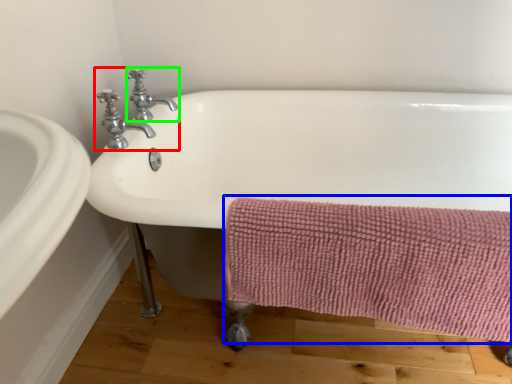
Question: Estimate the real-world distances between objects in this image. Which object is farther from tap (highlighted by a red box), bath towel (highlighted by a blue box) or tap (highlighted by a green box)?

Choices:
 (A) bath towel
 (B) tap

Answer: (A)